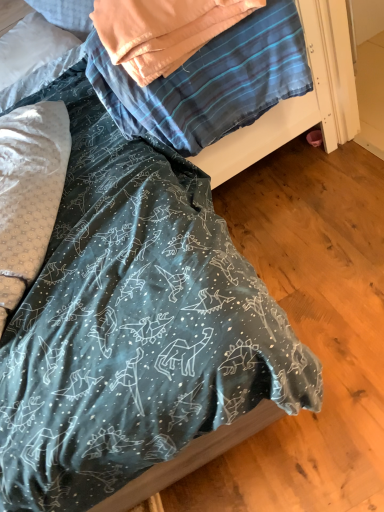
Question: Should I look upward or downward to see white soft pillow at upper left, which is the 2th pillow in bottom-to-top order?

Choices:
 (A) up
 (B) down

Answer: (A)

Question: From the image's perspective, is teal fabric at center above white soft pillow at upper left, which is the 2th pillow in bottom-to-top order?

Choices:
 (A) no
 (B) yes

Answer: (A)

Question: Is teal fabric at center outside white soft pillow at upper left, acting as the 1th pillow starting from the top?

Choices:
 (A) yes
 (B) no

Answer: (A)

Question: Is teal fabric at center positioned far away from white soft pillow at upper left, the second pillow when ordered from front to back?

Choices:
 (A) no
 (B) yes

Answer: (A)

Question: Considering the relative positions of teal fabric at center and white soft pillow at upper left, the 1th pillow in the back-to-front sequence, in the image provided, is teal fabric at center in front of white soft pillow at upper left, the 1th pillow in the back-to-front sequence,?

Choices:
 (A) yes
 (B) no

Answer: (A)

Question: Does teal fabric at center contain white soft pillow at upper left, the second pillow when ordered from front to back?

Choices:
 (A) yes
 (B) no

Answer: (B)

Question: Could you tell me if teal fabric at center is turned towards white soft pillow at upper left, which is the 2th pillow in bottom-to-top order?

Choices:
 (A) no
 (B) yes

Answer: (A)

Question: Can you confirm if white soft pillow at upper left, acting as the 1th pillow starting from the top, is thinner than white dotted fabric pillow at left, which appears as the 1th pillow when ordered from the bottom?

Choices:
 (A) yes
 (B) no

Answer: (A)

Question: Is white soft pillow at upper left, which is the 2th pillow in bottom-to-top order, at the left side of white dotted fabric pillow at left, which appears as the second pillow when viewed from the back?

Choices:
 (A) yes
 (B) no

Answer: (A)

Question: Is white soft pillow at upper left, the second pillow when ordered from front to back, directly adjacent to white dotted fabric pillow at left, which appears as the second pillow when viewed from the back?

Choices:
 (A) yes
 (B) no

Answer: (B)

Question: From the image's perspective, is white soft pillow at upper left, the second pillow when ordered from front to back, over white dotted fabric pillow at left, which appears as the second pillow when viewed from the back?

Choices:
 (A) yes
 (B) no

Answer: (A)

Question: Is white soft pillow at upper left, which is the 2th pillow in bottom-to-top order, oriented away from white dotted fabric pillow at left, which appears as the second pillow when viewed from the back?

Choices:
 (A) no
 (B) yes

Answer: (A)

Question: From a real-world perspective, is white soft pillow at upper left, the 1th pillow in the back-to-front sequence, located beneath white dotted fabric pillow at left, arranged as the 1th pillow when viewed from the front?

Choices:
 (A) no
 (B) yes

Answer: (A)

Question: From the image's perspective, is white dotted fabric pillow at left, arranged as the 1th pillow when viewed from the front, over white soft pillow at upper left, which is the 2th pillow in bottom-to-top order?

Choices:
 (A) yes
 (B) no

Answer: (B)